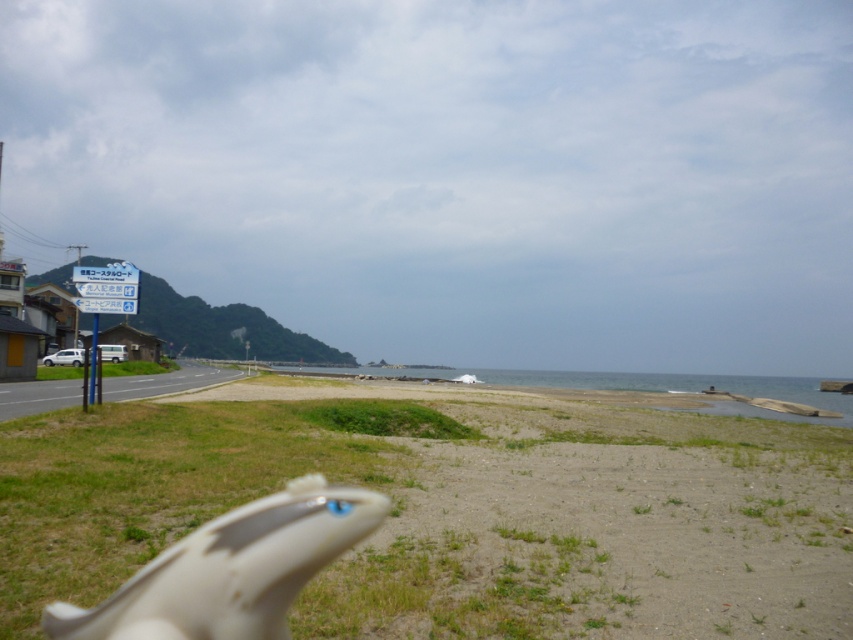
Between clear blue water at lower center and green grass at left, which one is positioned higher?

green grass at left is above.

Is clear blue water at lower center further to camera compared to green grass at left?

No.

Is point (503, 378) farther from viewer compared to point (140, 369)?

That is True.

Identify the location of clear blue water at lower center. The image size is (853, 640). (651, 387).

Can you confirm if clear blue water at lower center is shorter than white plastic sign at left?

Incorrect, clear blue water at lower center's height does not fall short of white plastic sign at left's.

Which is behind, point (575, 374) or point (90, 278)?

Point (575, 374)

Does point (691, 387) come farther from viewer compared to point (132, 289)?

Yes, point (691, 387) is behind point (132, 289).

Identify the location of clear blue water at lower center. The height and width of the screenshot is (640, 853). (651, 387).

Looking at this image, is gravelly sand beach at lower center smaller than green grass at left?

No, gravelly sand beach at lower center is not smaller than green grass at left.

Between point (563, 552) and point (113, 371), which one is positioned behind?

Point (113, 371)

At what (x,y) coordinates should I click in order to perform the action: click on gravelly sand beach at lower center. Please return your answer as a coordinate pair (x, y). Image resolution: width=853 pixels, height=640 pixels. Looking at the image, I should click on (456, 515).